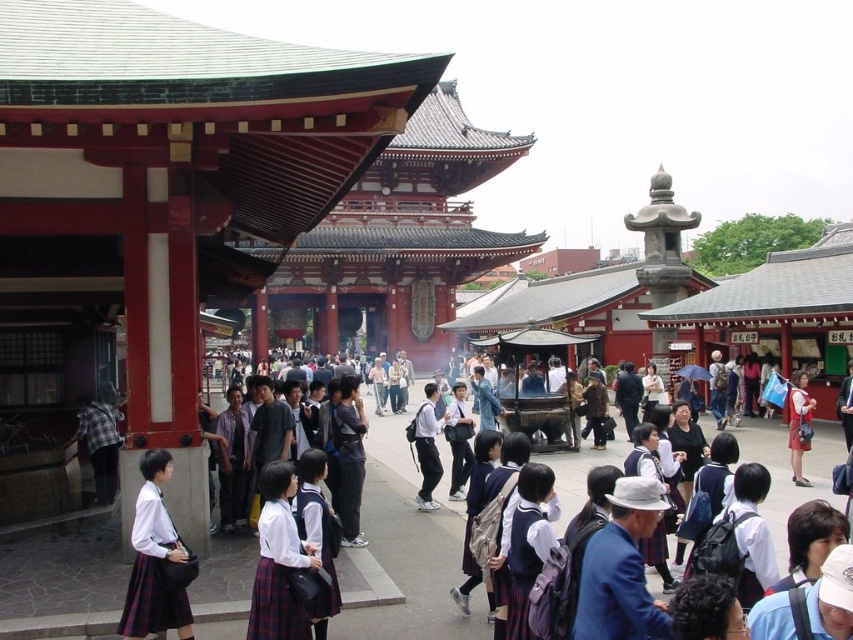
Question: Can you confirm if white school uniform at center is positioned to the right of dark blue uniform at center?

Choices:
 (A) no
 (B) yes

Answer: (A)

Question: Considering the real-world distances, which object is closest to the dark blue uniform at center?

Choices:
 (A) white cotton shirt at center
 (B) white school uniform at center

Answer: (B)

Question: Observing the image, what is the correct spatial positioning of white school uniform at center in reference to matte blue backpack at center?

Choices:
 (A) right
 (B) left

Answer: (B)

Question: Which object is the closest to the white cotton shirt at center?

Choices:
 (A) white school uniform at center
 (B) dark blue uniform at center

Answer: (B)

Question: Does white school uniform at center have a greater width compared to white cotton shirt at center?

Choices:
 (A) yes
 (B) no

Answer: (B)

Question: Which is farther from the white school uniform at center?

Choices:
 (A) white cotton shirt at center
 (B) dark blue uniform at center
 (C) matte blue backpack at center

Answer: (A)